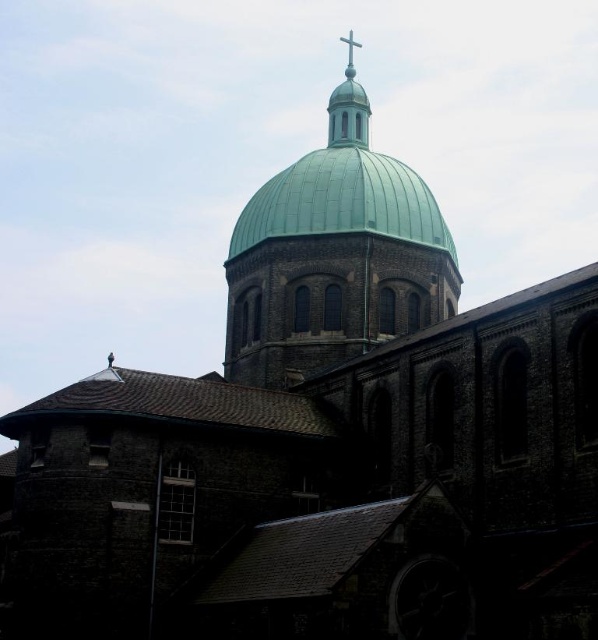
You are an architect assessing the church structure. You need to determine if the green dome at center can accommodate a new decorative element that requires a base wider than the metallic cross at upper center. Based on the current structure, is this feasible?

The green dome at center might be wider than metallic cross at upper center, so it is possible that the dome can accommodate the decorative element with a wider base than the cross.

You are a maintenance worker inspecting the church structure. You notice the green dome at center and the metallic cross at upper center. Which object is positioned higher up in the image?

The metallic cross at upper center is positioned higher up in the image than the green dome at center.

You are an architect analyzing the church structure. Based on the provided image, which object takes up more area in the scene between the green dome at center and the metallic cross at upper center?

The metallic cross at upper center occupies more space than the green dome at center according to the description.